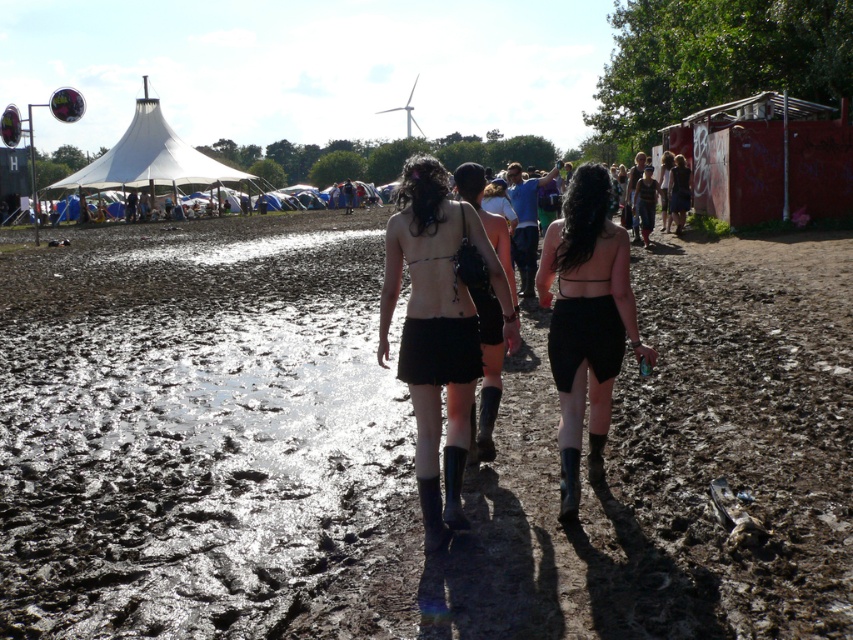
Between muddy wet ground at center and white canvas tent at upper left, which one has less height?

muddy wet ground at center

Does muddy wet ground at center appear on the right side of white canvas tent at upper left?

Yes, muddy wet ground at center is to the right of white canvas tent at upper left.

Who is more forward, [364,595] or [143,120]?

Point [364,595] is in front.

Image resolution: width=853 pixels, height=640 pixels. I want to click on muddy wet ground at center, so click(x=405, y=448).

Can you confirm if black matte shorts at center is wider than black matte skirt at center?

Yes.

Can you confirm if black matte shorts at center is positioned below black matte skirt at center?

Yes, black matte shorts at center is below black matte skirt at center.

The width and height of the screenshot is (853, 640). What are the coordinates of `black matte shorts at center` in the screenshot? It's located at (585, 321).

Who is lower down, matte black skirt at center or black matte skirt at center?

Positioned lower is matte black skirt at center.

What do you see at coordinates (438, 330) in the screenshot? I see `matte black skirt at center` at bounding box center [438, 330].

Identify the location of matte black skirt at center. (438, 330).